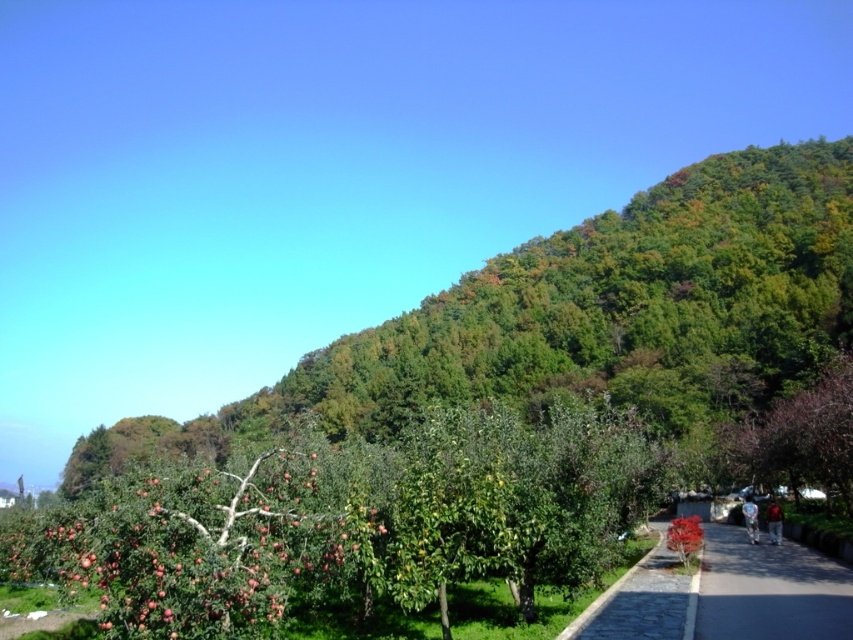
Does ripe red apples at lower left have a lesser height compared to smooth stone path at center?

No, ripe red apples at lower left is not shorter than smooth stone path at center.

Consider the image. Which is above, ripe red apples at lower left or smooth stone path at center?

ripe red apples at lower left is higher up.

At what (x,y) coordinates should I click in order to perform the action: click on ripe red apples at lower left. Please return your answer as a coordinate pair (x, y). The image size is (853, 640). Looking at the image, I should click on (200, 545).

Does ripe red apples at lower left have a lesser height compared to dark gray asphalt at lower right?

Incorrect, ripe red apples at lower left's height does not fall short of dark gray asphalt at lower right's.

Who is taller, ripe red apples at lower left or dark gray asphalt at lower right?

ripe red apples at lower left is taller.

At what (x,y) coordinates should I click in order to perform the action: click on ripe red apples at lower left. Please return your answer as a coordinate pair (x, y). This screenshot has width=853, height=640. Looking at the image, I should click on (200, 545).

Can you confirm if dark gray asphalt at lower right is positioned above smooth stone path at center?

Correct, dark gray asphalt at lower right is located above smooth stone path at center.

What are the coordinates of `dark gray asphalt at lower right` in the screenshot? It's located at (769, 589).

Locate an element on the screen. This screenshot has height=640, width=853. dark gray asphalt at lower right is located at coordinates (769, 589).